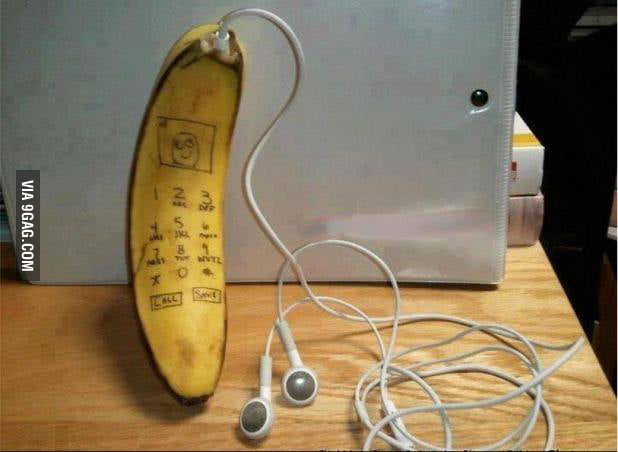
Where is `wood table`? The image size is (618, 452). wood table is located at coordinates click(x=70, y=395).